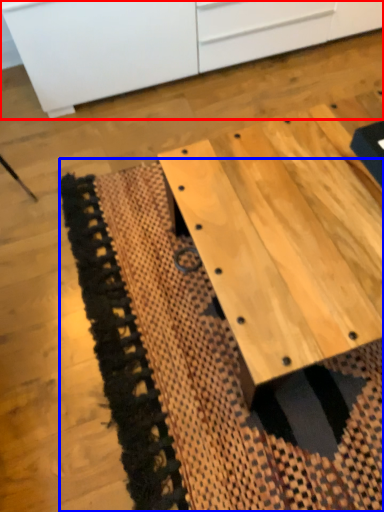
Question: Among these objects, which one is nearest to the camera, cabinetry (highlighted by a red box) or mat (highlighted by a blue box)?

Choices:
 (A) cabinetry
 (B) mat

Answer: (B)